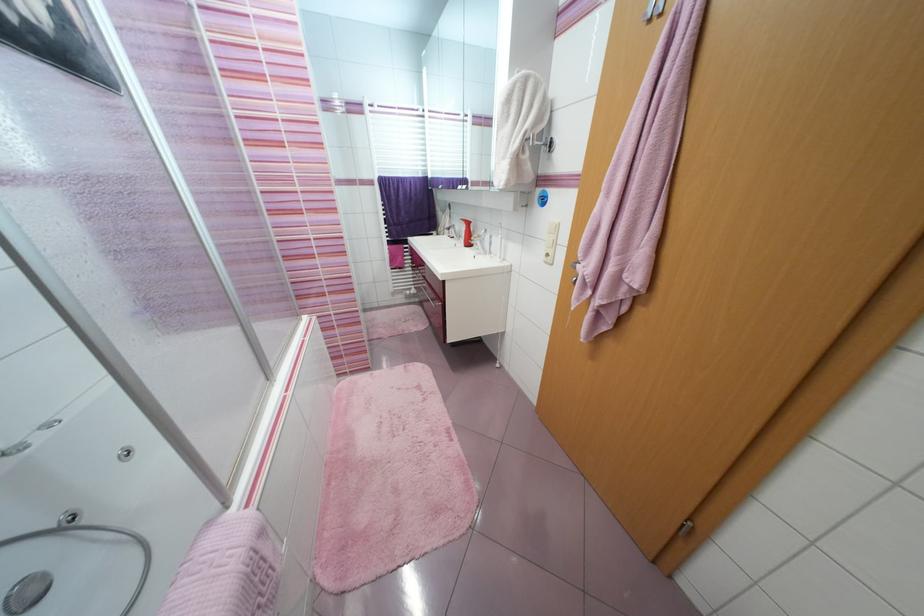
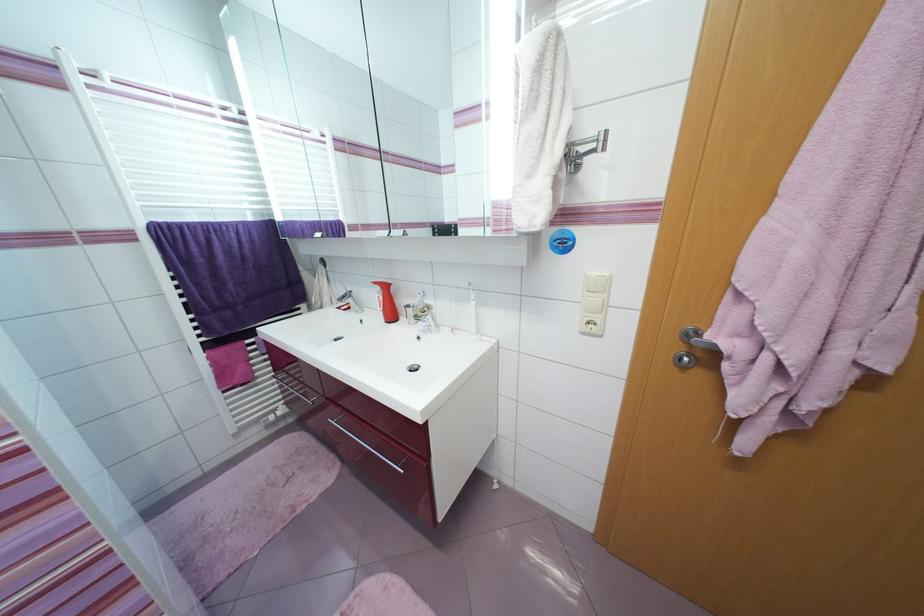
Question: Based on the continuous images, in which direction is the camera rotating? Reply with the corresponding letter.

Choices:
 (A) Left
 (B) Right
 (C) Up
 (D) Down

Answer: (B)